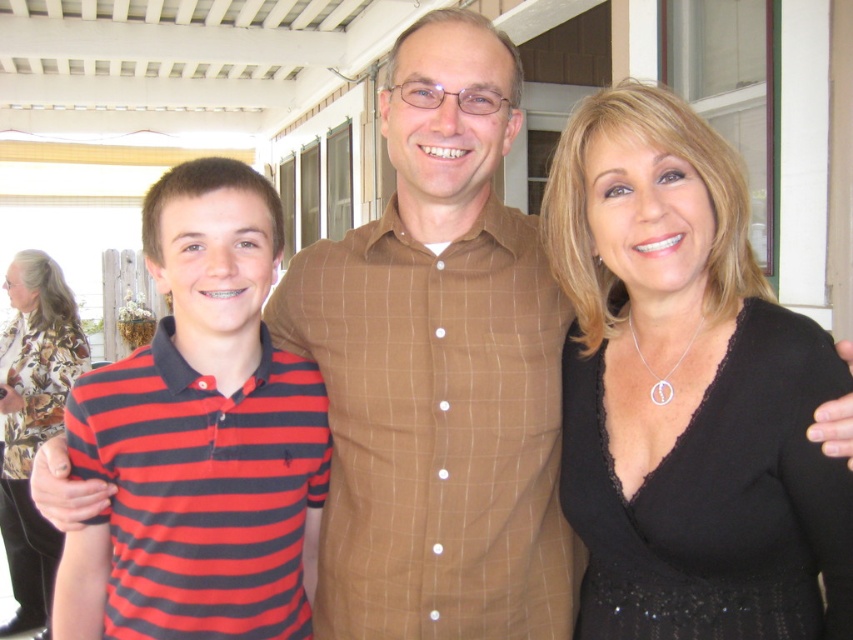
Question: Which point appears closest to the camera in this image?

Choices:
 (A) (231, 323)
 (B) (381, 237)
 (C) (49, 385)

Answer: (A)

Question: Which object is positioned farthest from the striped cotton polo shirt at left?

Choices:
 (A) black lace dress at center
 (B) printed silk blouse at left
 (C) brown checkered shirt at center

Answer: (B)

Question: Which of these objects is positioned farthest from the black lace dress at center?

Choices:
 (A) brown checkered shirt at center
 (B) printed silk blouse at left

Answer: (B)

Question: Does black lace dress at center have a smaller size compared to striped cotton polo shirt at left?

Choices:
 (A) yes
 (B) no

Answer: (B)

Question: Does black lace dress at center appear under striped cotton polo shirt at left?

Choices:
 (A) no
 (B) yes

Answer: (A)

Question: Is brown checkered shirt at center thinner than striped cotton polo shirt at left?

Choices:
 (A) no
 (B) yes

Answer: (A)